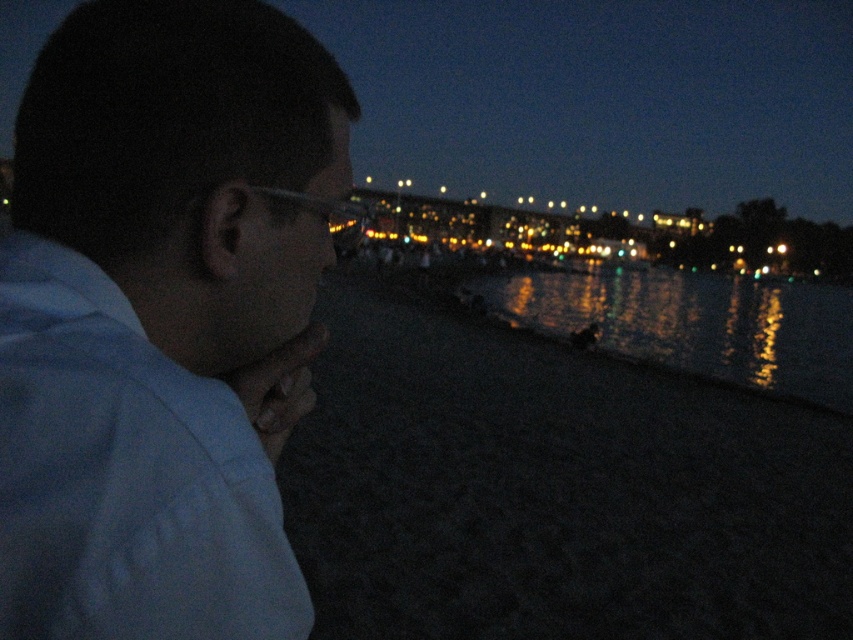
You are a photographer trying to capture the scene with a camera. You notice the white matte shirt at left and the glistening reflective water at lower center. Which object is shorter in height?

The white matte shirt at left is shorter than the glistening reflective water at lower center.

You are a photographer trying to capture the glistening reflective water at lower center in your shot. There is a person wearing a white matte shirt at left in the frame. Where should you position the person relative to the water to avoid blocking the reflection?

The white matte shirt at left is to the left of glistening reflective water at lower center, so to avoid blocking the reflection, position the person to the left side of the water in the frame.

You are a photographer trying to capture the reflection of the city lights on the glistening reflective water at lower center. However, the white matte shirt at left is blocking part of the view. Where should you position yourself relative to the scene to avoid the obstruction?

You should position yourself above the white matte shirt at left since it is located below the glistening reflective water at lower center, allowing you to capture the reflection without obstruction.